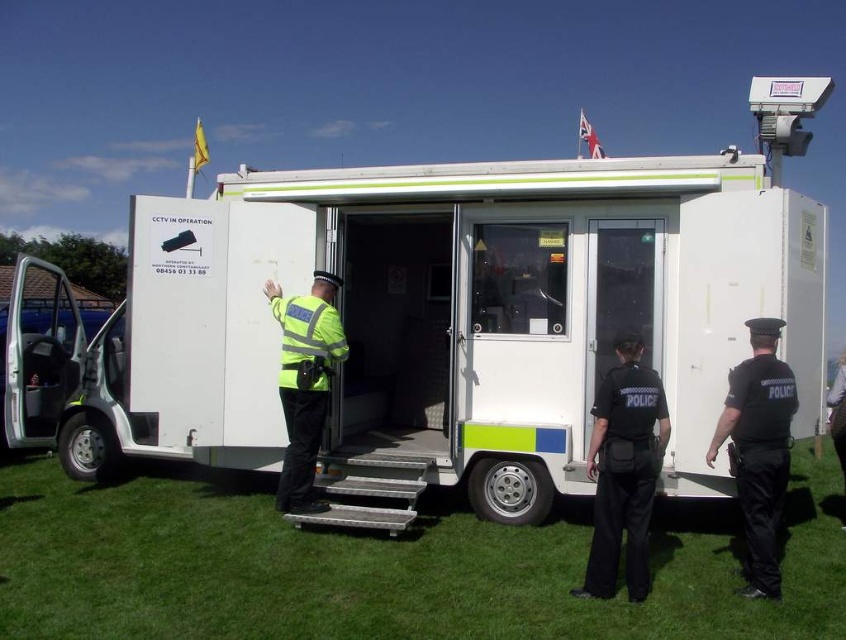
Question: Among these objects, which one is farthest from the camera?

Choices:
 (A) high visibility reflective jacket at center
 (B) green grass at lower center

Answer: (A)

Question: Is black uniform at right in front of high visibility reflective jacket at center?

Choices:
 (A) yes
 (B) no

Answer: (A)

Question: Does black uniform at right appear on the left side of high visibility reflective jacket at center?

Choices:
 (A) yes
 (B) no

Answer: (B)

Question: Considering the real-world distances, which object is farthest from the white plastic trailer at center?

Choices:
 (A) black uniform at center
 (B) green grass at lower center
 (C) high visibility reflective jacket at center

Answer: (B)

Question: Is black uniform at right smaller than high visibility reflective jacket at center?

Choices:
 (A) no
 (B) yes

Answer: (B)

Question: Which of these objects is positioned farthest from the green grass at lower center?

Choices:
 (A) high visibility reflective jacket at center
 (B) white plastic trailer at center
 (C) black uniform at center

Answer: (B)